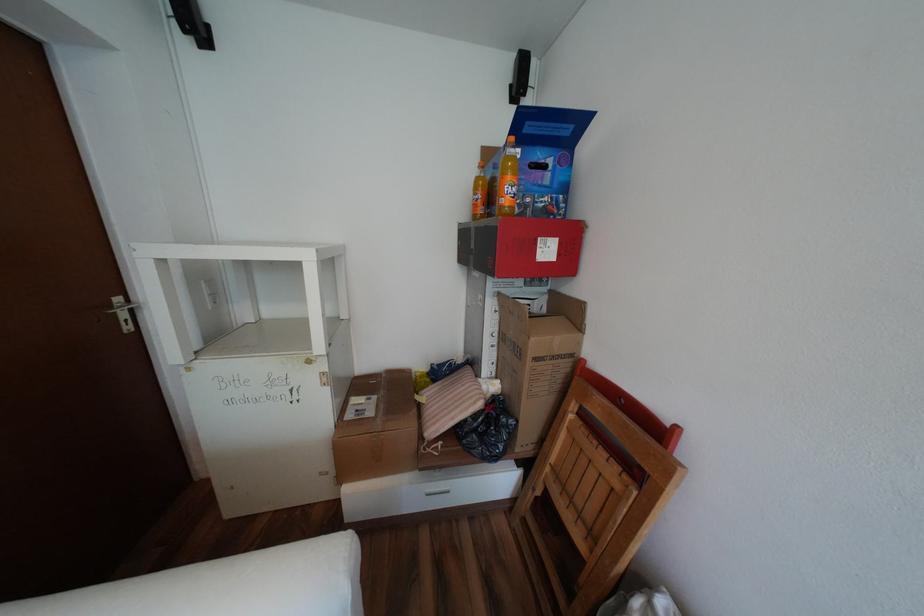
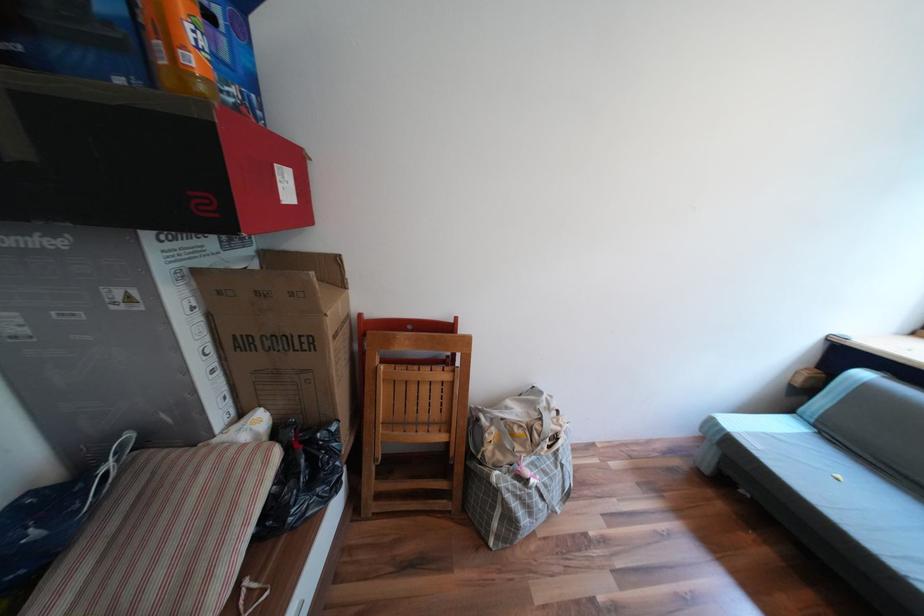
The point at (548,251) is marked in the first image. Where is the corresponding point in the second image?

(289, 185)